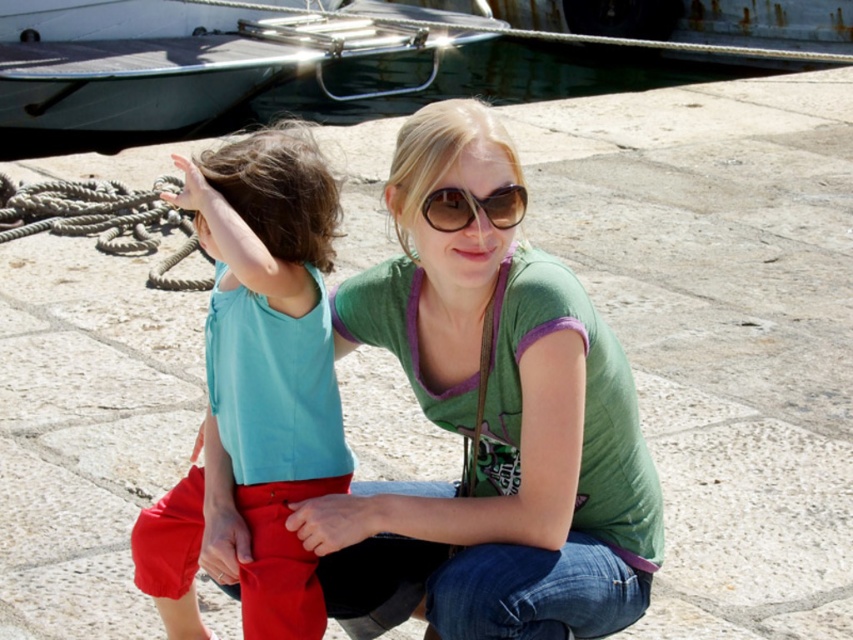
Question: Is the position of metallic gray boat at upper left more distant than that of roperoughrope at left?

Choices:
 (A) yes
 (B) no

Answer: (A)

Question: Which of the following is the closest to the observer?

Choices:
 (A) metallic gray boat at upper left
 (B) roperoughrope at left
 (C) matte teal tank top at center

Answer: (C)

Question: Which of these objects is positioned closest to the roperoughrope at left?

Choices:
 (A) green cotton shirt at center
 (B) metallic gray boat at upper left
 (C) brown matte sunglasses at center

Answer: (A)

Question: Is metallic gray boat at upper left positioned at the back of brown matte sunglasses at center?

Choices:
 (A) yes
 (B) no

Answer: (A)

Question: Does roperoughrope at left have a greater width compared to brown matte sunglasses at center?

Choices:
 (A) no
 (B) yes

Answer: (B)

Question: Which of the following is the farthest from the observer?

Choices:
 (A) (426, 112)
 (B) (169, 211)

Answer: (B)